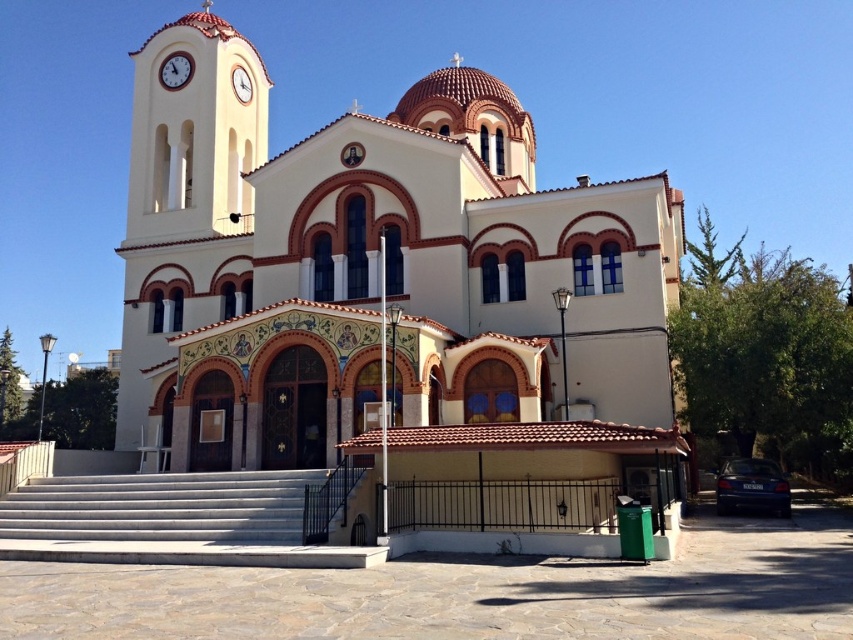
Does white painted stone church at center have a greater width compared to white stucco bell tower at upper left?

Yes.

Can you confirm if white painted stone church at center is bigger than white stucco bell tower at upper left?

Correct, white painted stone church at center is larger in size than white stucco bell tower at upper left.

Measure the distance between point (401, 276) and camera.

188.41 feet

Locate an element on the screen. This screenshot has width=853, height=640. white painted stone church at center is located at coordinates (384, 280).

Consider the image. Between white painted stone church at center and white glossy clock at upper left, which one has less height?

white glossy clock at upper left is shorter.

Who is positioned more to the left, white painted stone church at center or white glossy clock at upper left?

white glossy clock at upper left is more to the left.

Find the location of a particular element. white painted stone church at center is located at coordinates (384, 280).

Is white concrete stairs at lower left to the right of white glossy clock at upper left from the viewer's perspective?

Correct, you'll find white concrete stairs at lower left to the right of white glossy clock at upper left.

Does point (125, 502) lie behind point (186, 58)?

No.

Find the location of a particular element. The height and width of the screenshot is (640, 853). white concrete stairs at lower left is located at coordinates (161, 508).